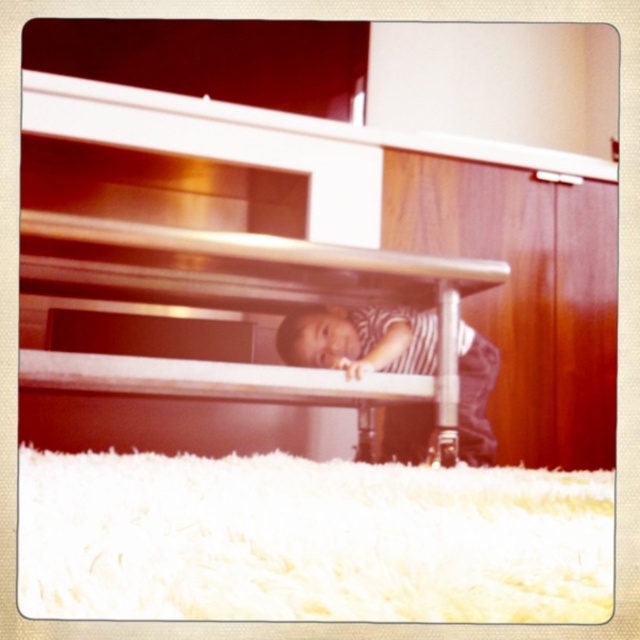
You are a parent trying to find your child in a room. You see a matte white bunk bed at lower center and a striped fabric toddler at lower center. Which object is closer to you?

The matte white bunk bed at lower center is closer to you because it is in front of the striped fabric toddler at lower center.

You are a parent trying to ensure the safety of your child. The child is under the table, and you need to reach them quickly. The matte white bunk bed at lower center and the striped fabric toddler at lower center are in the scene. How far apart are these two objects?

The matte white bunk bed at lower center is 24.68 centimeters from the striped fabric toddler at lower center.

You are a parent trying to find your child who is hiding under the table. The table is part of the matte white bunk bed at lower center. Can you see the child from your current position?

The position of matte white bunk bed at lower center is at point [236,307]. Since the child is partially hidden under the table, you might see parts of them like their head or upper body if you look directly at the bunk bed at lower center.